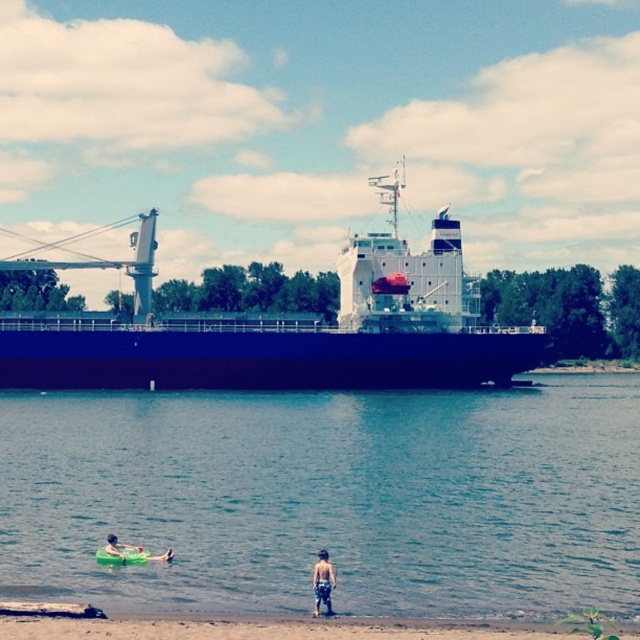
You are a photographer positioned at the riverbank and want to capture both the point at coordinates point (260,500) and point (324,566) in your shot. Which point is closer to your camera?

Point (324,566) is closer to the camera because point (260,500) is further away from the camera than point (324,566).

Based on the coordinates provided, which object in the scene corresponds to the point with coordinates (328, 497)?

The point with coordinates (328, 497) corresponds to the clear blue water at lower center.